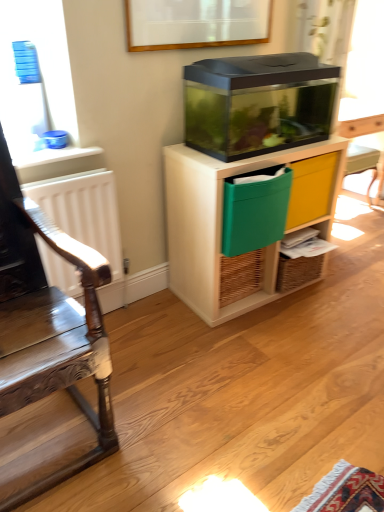
Locate an element on the screen. vacant region below white matte radiator at left (from a real-world perspective) is located at coordinates (114, 318).